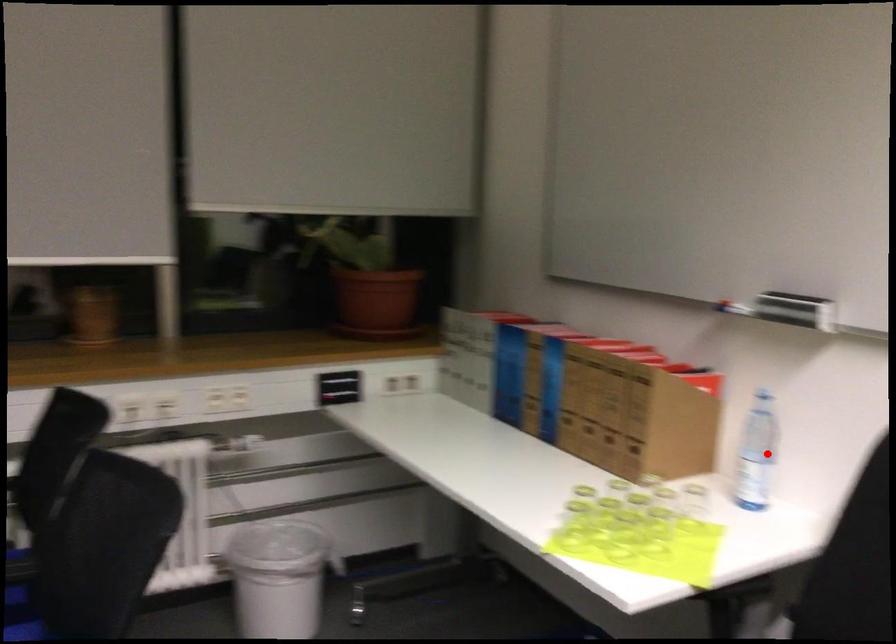
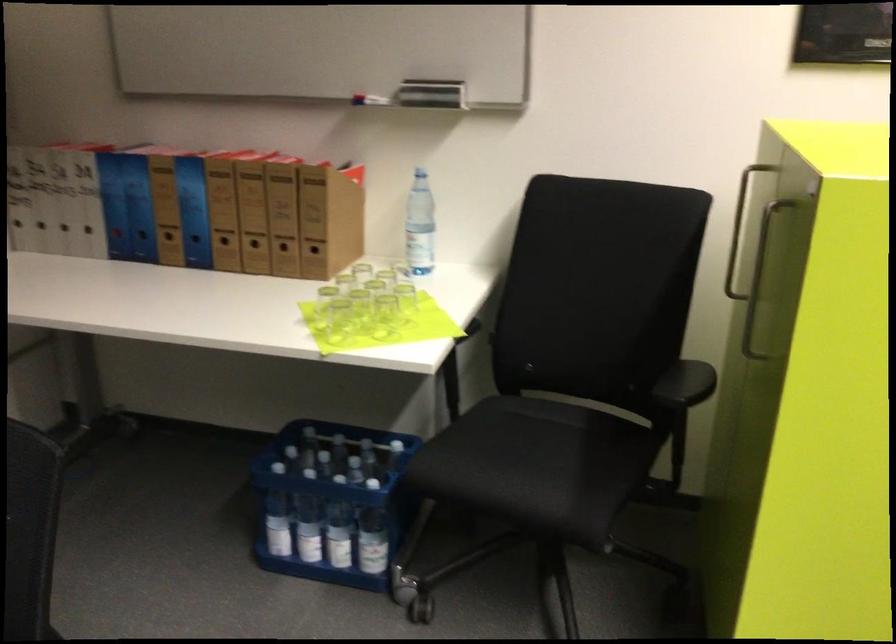
Question: I am providing you with two images of the same scene from different viewpoints. Image1 has a red point marked. In image2, the corresponding 3D location appears at what relative position? Reply with the corresponding letter.

Choices:
 (A) Closer
 (B) Farther

Answer: (B)